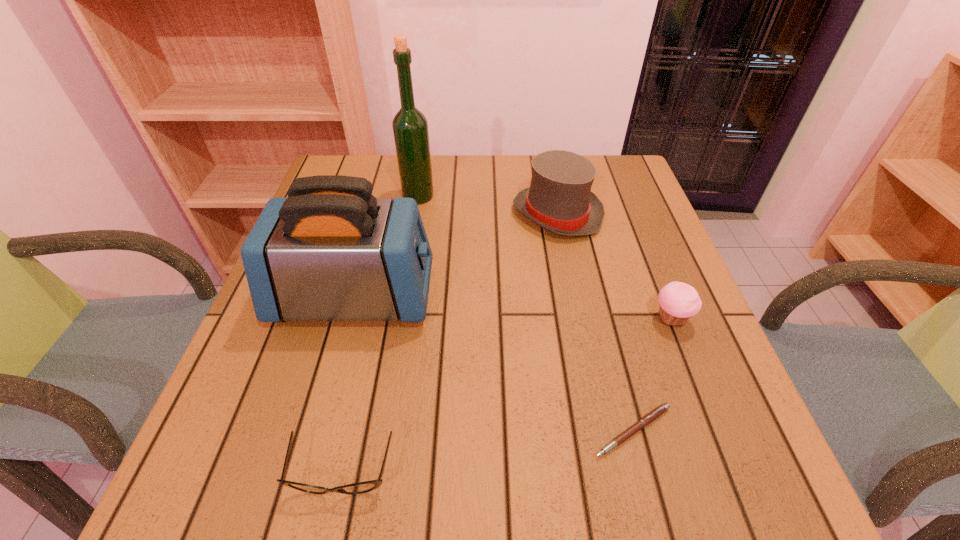
This screenshot has height=540, width=960. In order to click on vacant area that lies between the tallest object and the fourth shortest object in this screenshot , I will do pyautogui.click(x=488, y=205).

Identify the location of free space between the cupcake and the tallest object. (544, 258).

This screenshot has height=540, width=960. Identify the location of vacant space that is in between the shortest object and the second shortest object. (488, 451).

Image resolution: width=960 pixels, height=540 pixels. What are the coordinates of `free space between the second shortest object and the rightmost object` in the screenshot? It's located at coord(506,395).

This screenshot has width=960, height=540. I want to click on vacant space that is in between the fifth shortest object and the dress hat, so click(x=456, y=255).

At what (x,y) coordinates should I click in order to perform the action: click on empty space between the third tallest object and the cupcake. Please return your answer as a coordinate pair (x, y). Image resolution: width=960 pixels, height=540 pixels. Looking at the image, I should click on tap(613, 266).

You are a GUI agent. You are given a task and a screenshot of the screen. Output one action in this format:
    pyautogui.click(x=<x>, y=<y>)
    Task: Click on the blank region between the fifth shortest object and the spectacles
    
    Given the screenshot: What is the action you would take?
    pyautogui.click(x=348, y=384)

This screenshot has height=540, width=960. I want to click on blank region between the cupcake and the fourth shortest object, so click(613, 266).

You are a GUI agent. You are given a task and a screenshot of the screen. Output one action in this format:
    pyautogui.click(x=<x>, y=<y>)
    Task: Click on the closest object to the tallest object
    
    Given the screenshot: What is the action you would take?
    pyautogui.click(x=559, y=199)

Locate which object is the third closest to the fourth tallest object. Please provide its 2D coordinates. Your answer should be formatted as a tuple, i.e. [(x, y)], where the tuple contains the x and y coordinates of a point satisfying the conditions above.

[(331, 251)]